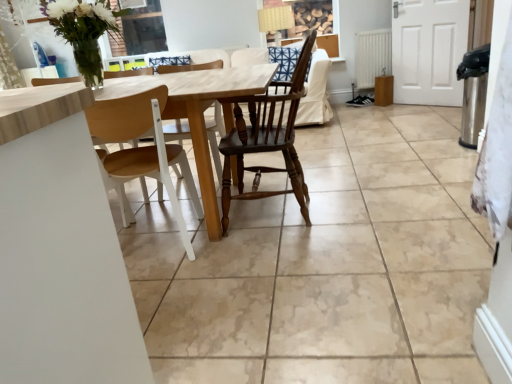
Identify the location of free space in front of dark wood chair at center, positioned as the 1th chair in right-to-left order. The image size is (512, 384). (283, 258).